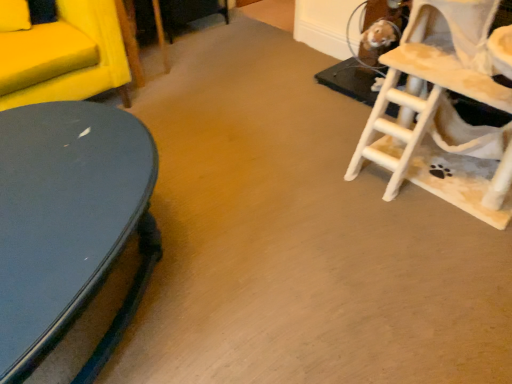
You are a GUI agent. You are given a task and a screenshot of the screen. Output one action in this format:
    pyautogui.click(x=<x>, y=<y>)
    Task: Click on the vacant space that's between glossy dark blue table at left and white wooden ladder at right
    
    Given the screenshot: What is the action you would take?
    pyautogui.click(x=291, y=233)